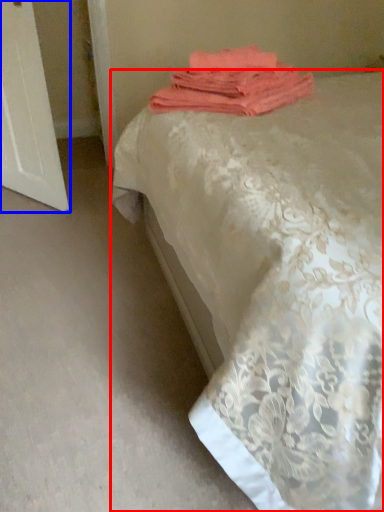
Question: Which point is closer to the camera, bed (highlighted by a red box) or screen door (highlighted by a blue box)?

Choices:
 (A) bed
 (B) screen door

Answer: (A)